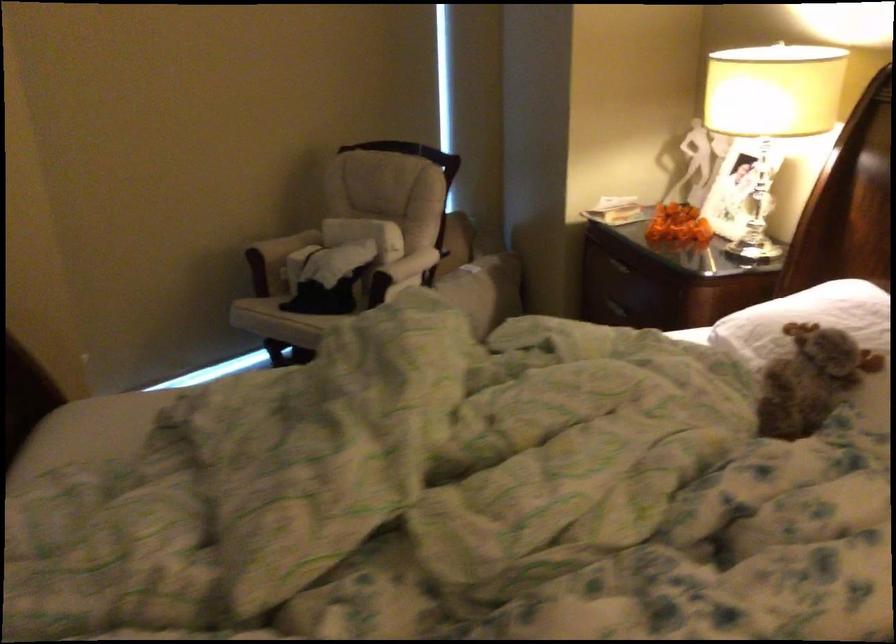
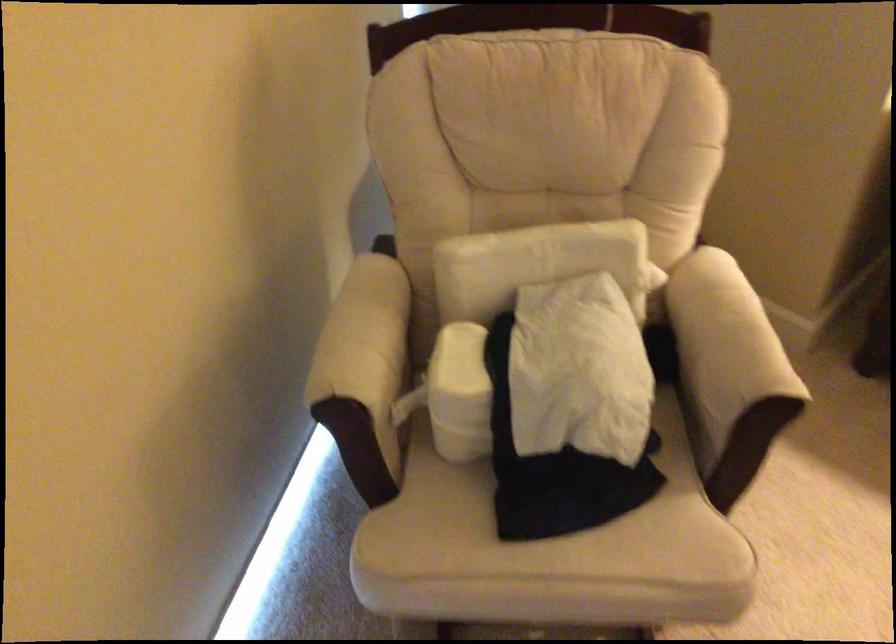
Find the pixel in the second image that matches point 354,228 in the first image.

(533, 263)